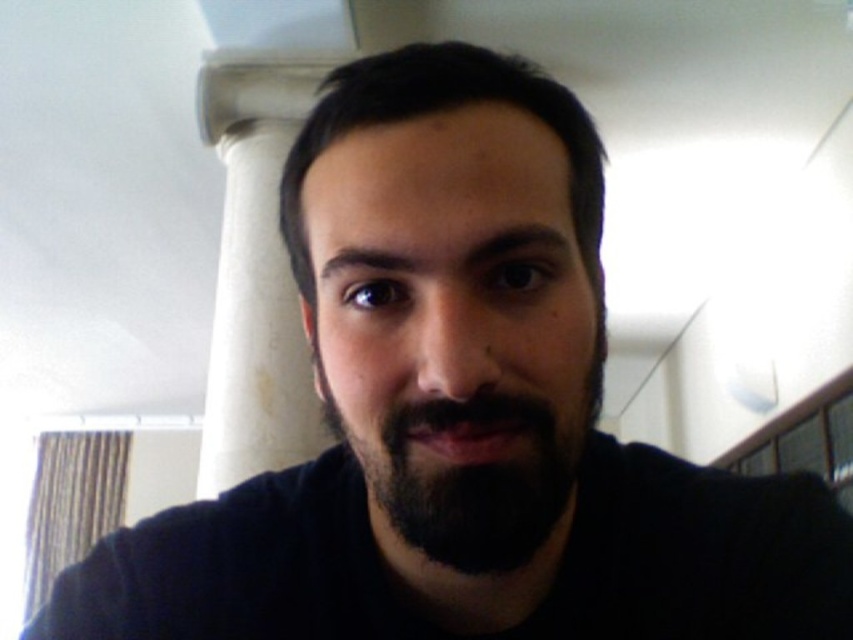
You are an interior designer assessing the lighting in this space. You notice the white marble pillar at upper center and the black fuzzy beard at center. Which object is positioned higher in the image?

The white marble pillar at upper center is taller than the black fuzzy beard at center, so the white marble pillar at upper center is positioned higher in the image.

You are standing at the camera position taking a photo of a person. The point you want to focus on is point (263, 163). If you need to adjust your focus to a point that is exactly 5 feet away from you, should you move closer or farther away from the current position?

The point (263, 163) is currently 6.45 feet away from you. To adjust focus to a point that is exactly 5 feet away, you should move closer to the subject since 5 feet is less than 6.45 feet.